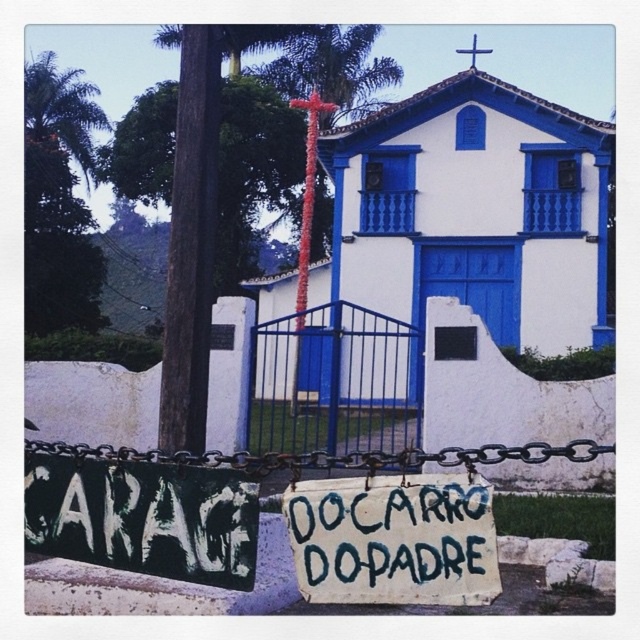
Question: Among these points, which one is nearest to the camera?

Choices:
 (A) (352, 552)
 (B) (410, 451)
 (C) (556, 259)

Answer: (A)

Question: Estimate the real-world distances between objects in this image. Which object is farther from the black metal chain at lower center?

Choices:
 (A) white painted wood church at center
 (B) white painted wood sign at center
 (C) metallic blue gate at center
 (D) red floral pole at center

Answer: (D)

Question: Can you confirm if white painted wood sign at center is bigger than black metal chain at lower center?

Choices:
 (A) no
 (B) yes

Answer: (B)

Question: Can you confirm if white painted wood sign at center is positioned below metallic blue gate at center?

Choices:
 (A) yes
 (B) no

Answer: (A)

Question: From the image, what is the correct spatial relationship of white painted wood sign at center in relation to black metal chain at lower center?

Choices:
 (A) left
 (B) right

Answer: (A)

Question: Which object is farther from the camera taking this photo?

Choices:
 (A) white painted wood sign at center
 (B) white painted wood church at center
 (C) metallic blue gate at center

Answer: (B)